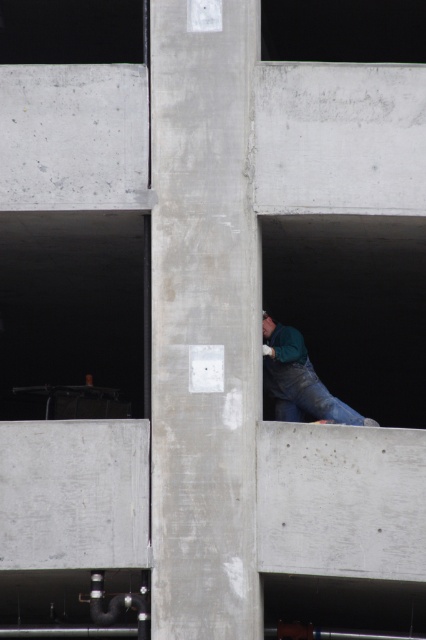
Question: Which object appears closest to the camera in this image?

Choices:
 (A) transparent glass window at upper left
 (B) green matte shirt at upper center
 (C) blue denim jeans at lower center
 (D) black glass window at upper center

Answer: (B)

Question: Which point is closer to the camera?

Choices:
 (A) (405, 35)
 (B) (2, 61)
 (C) (271, 376)

Answer: (C)

Question: Which of the following is the closest to the observer?

Choices:
 (A) (279, 48)
 (B) (34, 17)

Answer: (B)

Question: Is transparent glass window at upper left wider than green matte shirt at upper center?

Choices:
 (A) no
 (B) yes

Answer: (B)

Question: Where is black glass window at upper center located in relation to green matte shirt at upper center in the image?

Choices:
 (A) below
 (B) above

Answer: (B)

Question: Is concrete at center bigger than green matte shirt at upper center?

Choices:
 (A) no
 (B) yes

Answer: (B)